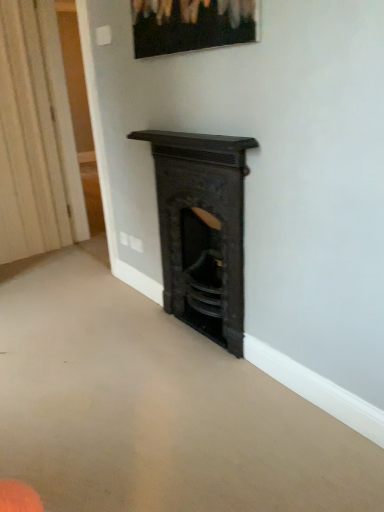
Question: Is matte black picture frame at upper center to the right of black cast iron fireplace at center from the viewer's perspective?

Choices:
 (A) no
 (B) yes

Answer: (A)

Question: Are matte black picture frame at upper center and black cast iron fireplace at center located far from each other?

Choices:
 (A) no
 (B) yes

Answer: (A)

Question: Can you confirm if matte black picture frame at upper center is wider than black cast iron fireplace at center?

Choices:
 (A) yes
 (B) no

Answer: (B)

Question: Could you tell me if matte black picture frame at upper center is turned towards black cast iron fireplace at center?

Choices:
 (A) no
 (B) yes

Answer: (A)

Question: Is the surface of matte black picture frame at upper center in direct contact with black cast iron fireplace at center?

Choices:
 (A) no
 (B) yes

Answer: (A)

Question: Considering the relative positions of matte black picture frame at upper center and black cast iron fireplace at center in the image provided, is matte black picture frame at upper center behind black cast iron fireplace at center?

Choices:
 (A) no
 (B) yes

Answer: (A)

Question: Is black cast iron fireplace at center turned away from white textured curtain at left?

Choices:
 (A) yes
 (B) no

Answer: (B)

Question: Is black cast iron fireplace at center not close to white textured curtain at left?

Choices:
 (A) no
 (B) yes

Answer: (B)

Question: Does black cast iron fireplace at center touch white textured curtain at left?

Choices:
 (A) yes
 (B) no

Answer: (B)

Question: Considering the relative sizes of black cast iron fireplace at center and white textured curtain at left in the image provided, is black cast iron fireplace at center thinner than white textured curtain at left?

Choices:
 (A) yes
 (B) no

Answer: (B)

Question: Can you confirm if black cast iron fireplace at center is shorter than white textured curtain at left?

Choices:
 (A) no
 (B) yes

Answer: (B)

Question: Does black cast iron fireplace at center lie in front of white textured curtain at left?

Choices:
 (A) no
 (B) yes

Answer: (B)

Question: Is white textured curtain at left positioned with its back to matte black picture frame at upper center?

Choices:
 (A) yes
 (B) no

Answer: (B)